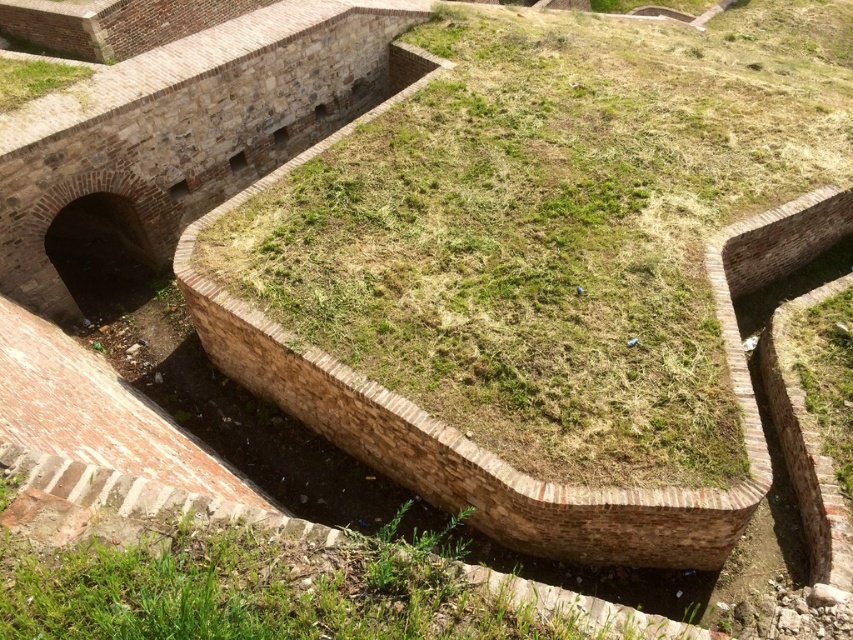
You are a maintenance worker assigned to mow the lawn in the fortification. You have two areas to mow today, the green grassy at center and the green grassy at upper left. Which area requires more time to mow based on their sizes?

The green grassy at center requires more time to mow since its width is greater than the green grassy at upper left.

You are standing inside the historical fortification and want to take a photo of both the point at coordinates [659,390] and the point at coordinates [18,93]. Based on their positions, which point will appear larger in your camera view?

Point at coordinates [659,390] will appear larger in the camera view because it is closer to the camera compared to point at coordinates [18,93].